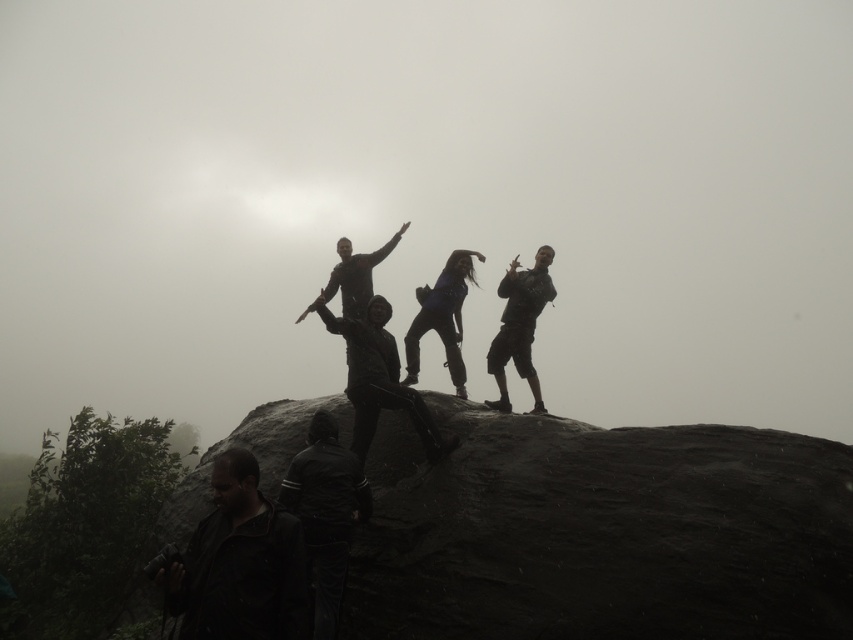
Is dark gray jacket at lower left wider than dark gray pants at upper right?

Incorrect, dark gray jacket at lower left's width does not surpass dark gray pants at upper right's.

Which is more to the left, dark gray jacket at lower left or dark gray pants at upper right?

Positioned to the left is dark gray jacket at lower left.

Which is behind, point (183, 637) or point (502, 406)?

The point (502, 406) is behind.

The height and width of the screenshot is (640, 853). What are the coordinates of `dark gray jacket at lower left` in the screenshot? It's located at (239, 563).

Is dark gray jacket at lower left shorter than dark blue fabric pants at center?

Correct, dark gray jacket at lower left is not as tall as dark blue fabric pants at center.

Who is more distant from viewer, (231, 547) or (450, 289)?

Positioned behind is point (450, 289).

At what (x,y) coordinates should I click in order to perform the action: click on dark gray jacket at lower left. Please return your answer as a coordinate pair (x, y). The width and height of the screenshot is (853, 640). Looking at the image, I should click on (239, 563).

Does point (318, 445) come behind point (408, 372)?

No, (318, 445) is in front of (408, 372).

Is dark gray leather jacket at lower left above dark blue fabric pants at center?

Actually, dark gray leather jacket at lower left is below dark blue fabric pants at center.

Locate an element on the screen. dark gray leather jacket at lower left is located at coordinates (325, 515).